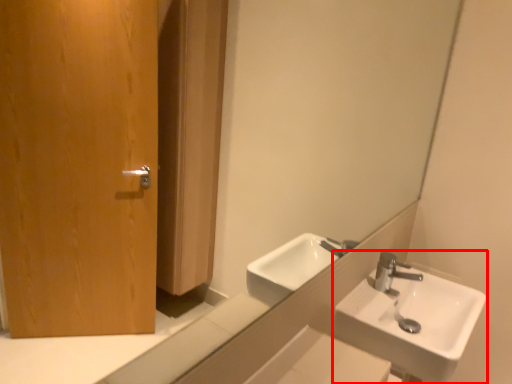
Question: From the image's perspective, where is sink (annotated by the red box) located in relation to mirror in the image?

Choices:
 (A) above
 (B) below

Answer: (B)